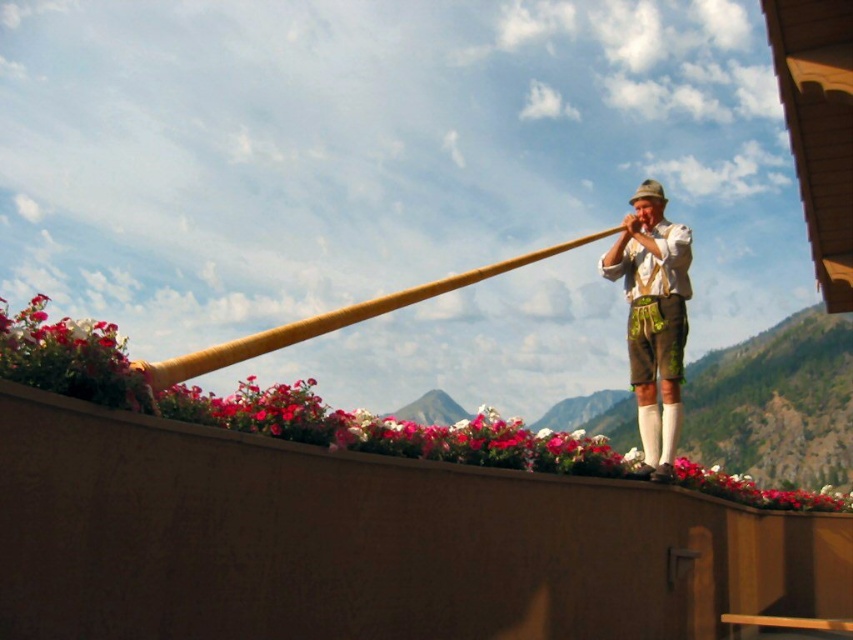
Which is more to the right, brown leather shorts at center or wooden horn at upper center?

brown leather shorts at center is more to the right.

In the scene shown: Who is more forward, (x=643, y=468) or (x=402, y=292)?

Point (x=402, y=292)

What are the coordinates of `brown leather shorts at center` in the screenshot? It's located at (653, 317).